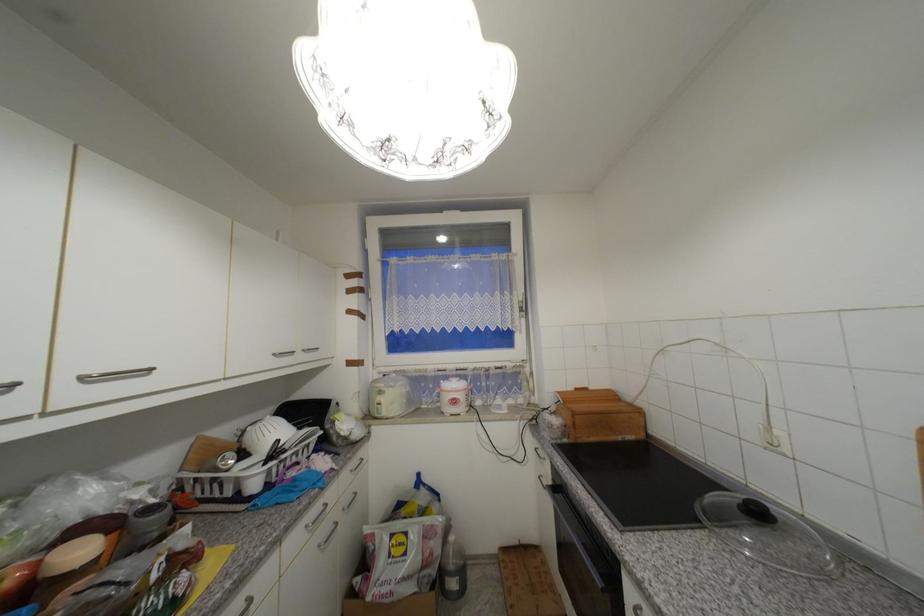
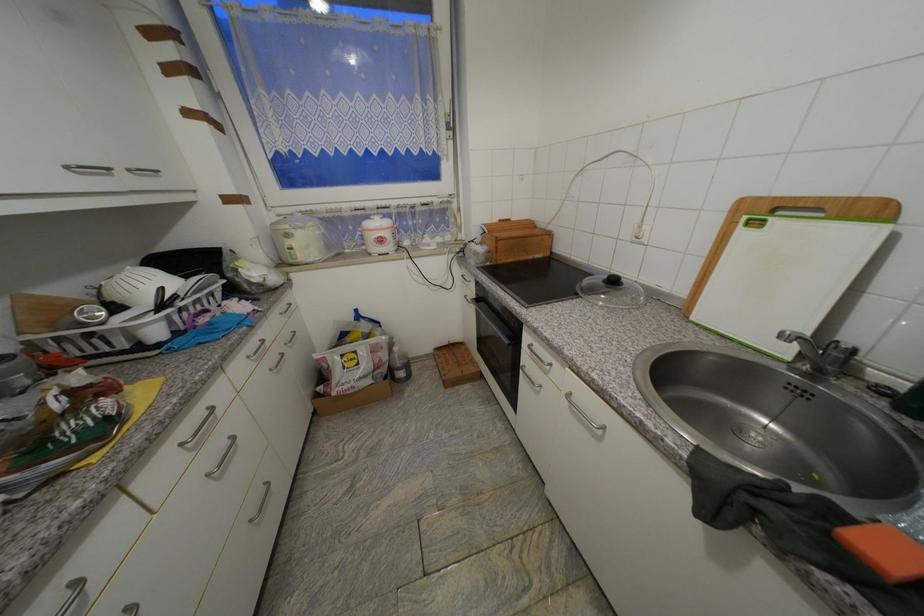
The images are taken continuously from a first-person perspective. In which direction is your viewpoint rotating?

The camera's rotation is toward right-down.